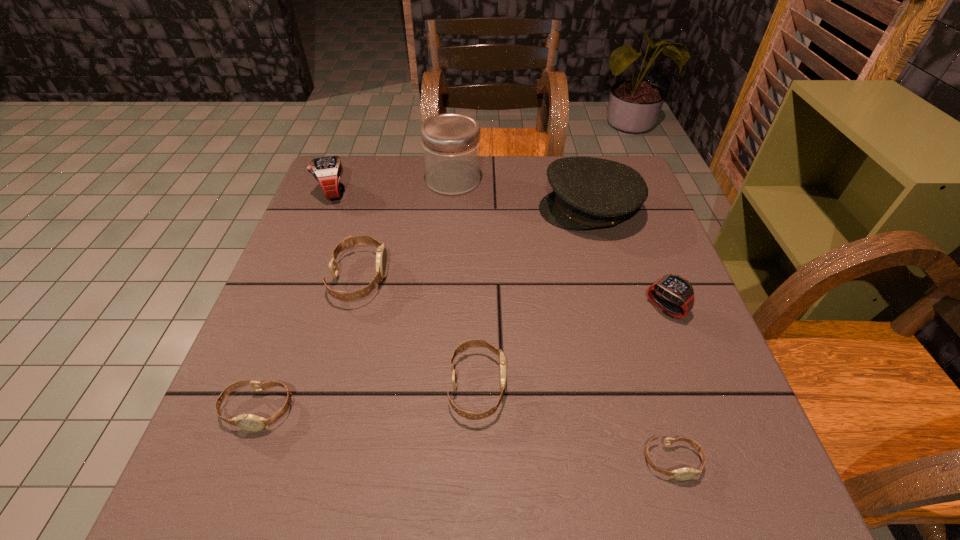
This screenshot has width=960, height=540. I want to click on the seventh tallest object, so click(x=249, y=422).

What are the coordinates of `the third biggest beige watch` in the screenshot? It's located at (249, 422).

Find the location of `the nearest object`. the nearest object is located at coordinates pyautogui.click(x=687, y=473).

Find the location of `the nearest beige watch`. the nearest beige watch is located at coordinates (687, 473).

The image size is (960, 540). I want to click on free point located 0.390m on the front of the tallest object, so click(444, 305).

Locate an element on the screen. The image size is (960, 540). free space located on the front-facing side of the beret is located at coordinates (486, 210).

Find the location of `blank space located 0.060m on the front-facing side of the beret`. blank space located 0.060m on the front-facing side of the beret is located at coordinates (516, 210).

Find the location of a particular element. The image size is (960, 540). vacant space situated 0.130m on the front-facing side of the beret is located at coordinates (490, 210).

Identify the location of vacant area situated 0.310m on the front of the bigger red watch. (293, 292).

Where is `free space located on the face of the biggest beige watch`? free space located on the face of the biggest beige watch is located at coordinates (426, 278).